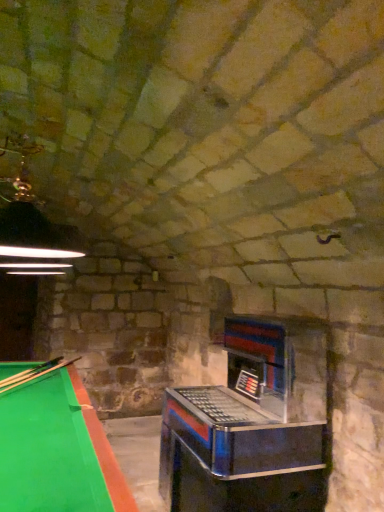
Question: From the image's perspective, is metallic/reflective slot machine at center-right beneath wooden smooth cue at lower left?

Choices:
 (A) yes
 (B) no

Answer: (A)

Question: From a real-world perspective, is metallic/reflective slot machine at center-right physically below wooden smooth cue at lower left?

Choices:
 (A) yes
 (B) no

Answer: (A)

Question: Considering the relative sizes of metallic/reflective slot machine at center-right and wooden smooth cue at lower left in the image provided, is metallic/reflective slot machine at center-right thinner than wooden smooth cue at lower left?

Choices:
 (A) no
 (B) yes

Answer: (B)

Question: Is metallic/reflective slot machine at center-right positioned before wooden smooth cue at lower left?

Choices:
 (A) yes
 (B) no

Answer: (A)

Question: Is wooden smooth cue at lower left surrounded by metallic/reflective slot machine at center-right?

Choices:
 (A) yes
 (B) no

Answer: (B)

Question: Does metallic/reflective slot machine at center-right appear on the right side of wooden smooth cue at lower left?

Choices:
 (A) no
 (B) yes

Answer: (B)

Question: From a real-world perspective, is wooden smooth cue at lower left physically above metallic/reflective slot machine at center-right?

Choices:
 (A) no
 (B) yes

Answer: (B)

Question: Is wooden smooth cue at lower left bigger than metallic/reflective slot machine at center-right?

Choices:
 (A) yes
 (B) no

Answer: (B)

Question: Considering the relative sizes of wooden smooth cue at lower left and metallic/reflective slot machine at center-right in the image provided, is wooden smooth cue at lower left thinner than metallic/reflective slot machine at center-right?

Choices:
 (A) no
 (B) yes

Answer: (A)

Question: Are wooden smooth cue at lower left and metallic/reflective slot machine at center-right far apart?

Choices:
 (A) yes
 (B) no

Answer: (A)

Question: Is wooden smooth cue at lower left beside metallic/reflective slot machine at center-right?

Choices:
 (A) yes
 (B) no

Answer: (B)

Question: Does wooden smooth cue at lower left have a lesser height compared to metallic/reflective slot machine at center-right?

Choices:
 (A) yes
 (B) no

Answer: (A)

Question: In the image, is wooden smooth cue at lower left positioned in front of or behind metallic/reflective slot machine at center-right?

Choices:
 (A) front
 (B) behind

Answer: (B)